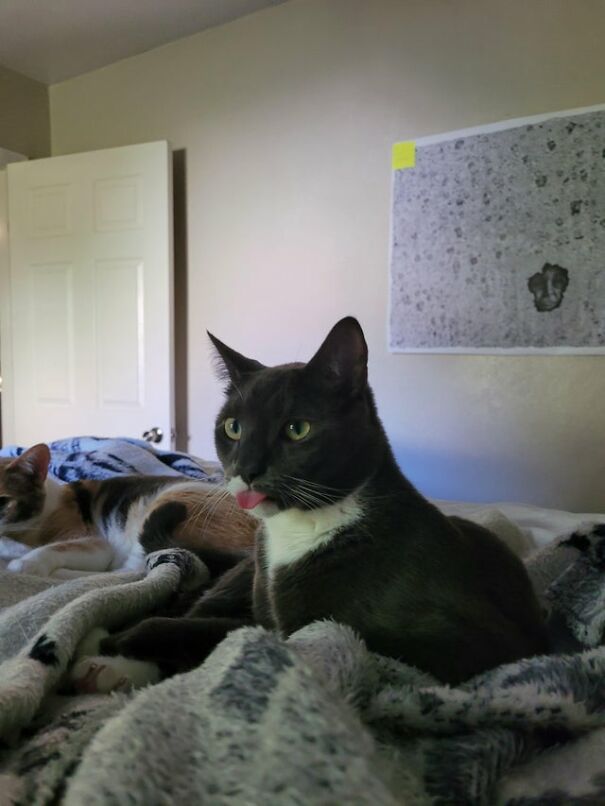
Find the location of a particular element. This screenshot has width=605, height=806. bedroom wall is located at coordinates (500, 416).